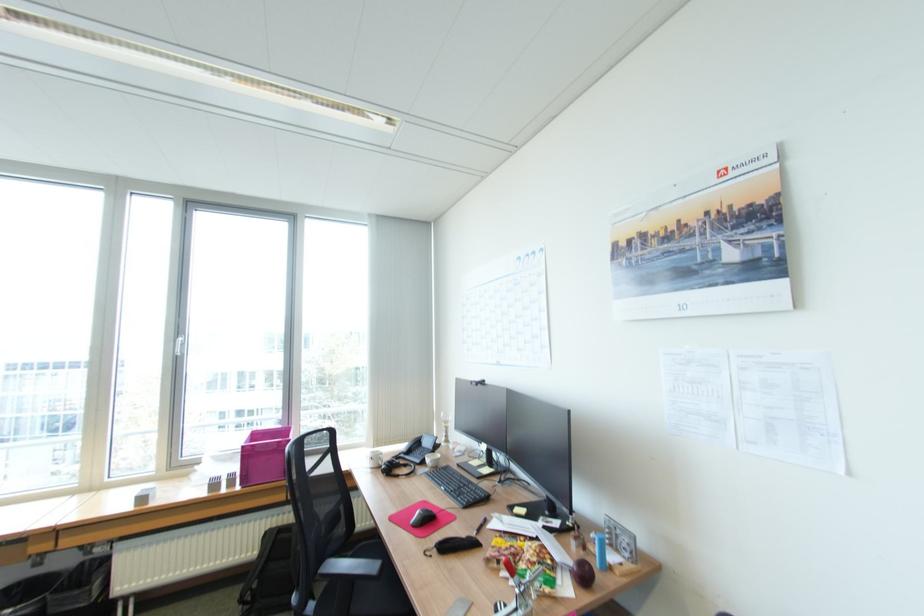
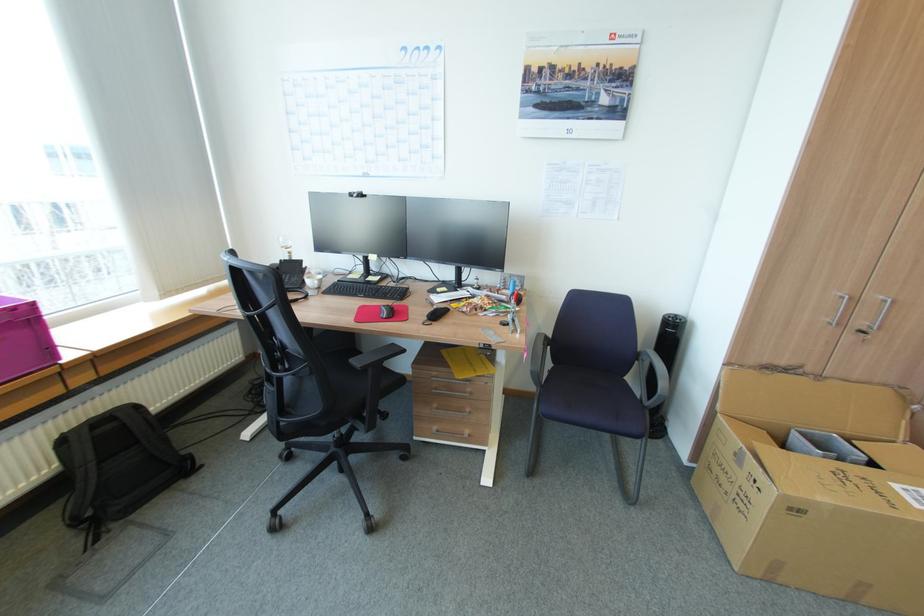
In the second image, find the point that corresponds to point (464, 464) in the first image.

(344, 281)